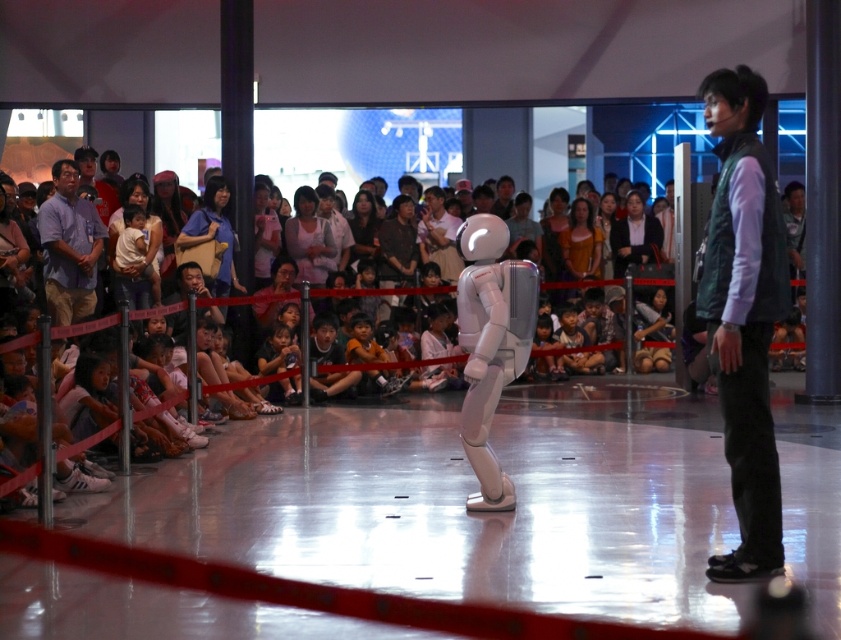
Is dark green vest at right thinner than matte black bag at center?

Indeed, dark green vest at right has a lesser width compared to matte black bag at center.

Does dark green vest at right appear under matte black bag at center?

Yes.

Does point (746, 157) come closer to viewer compared to point (226, 256)?

Yes.

Where is `dark green vest at right`? The height and width of the screenshot is (640, 841). dark green vest at right is located at coordinates (744, 316).

Who is positioned more to the right, matte black bag at center or dark gray suit at center?

From the viewer's perspective, dark gray suit at center appears more on the right side.

Is point (223, 211) farther from viewer compared to point (652, 253)?

No.

Is point (228, 244) more distant than point (620, 220)?

No, (228, 244) is in front of (620, 220).

Locate an element on the screen. This screenshot has height=640, width=841. matte black bag at center is located at coordinates (214, 232).

Measure the distance from light pink fabric at center to matte black hair at center.

light pink fabric at center is 97.64 centimeters from matte black hair at center.

From the picture: Is light pink fabric at center taller than matte black hair at center?

Yes, light pink fabric at center is taller than matte black hair at center.

Where is `light pink fabric at center`? Image resolution: width=841 pixels, height=640 pixels. light pink fabric at center is located at coordinates (309, 241).